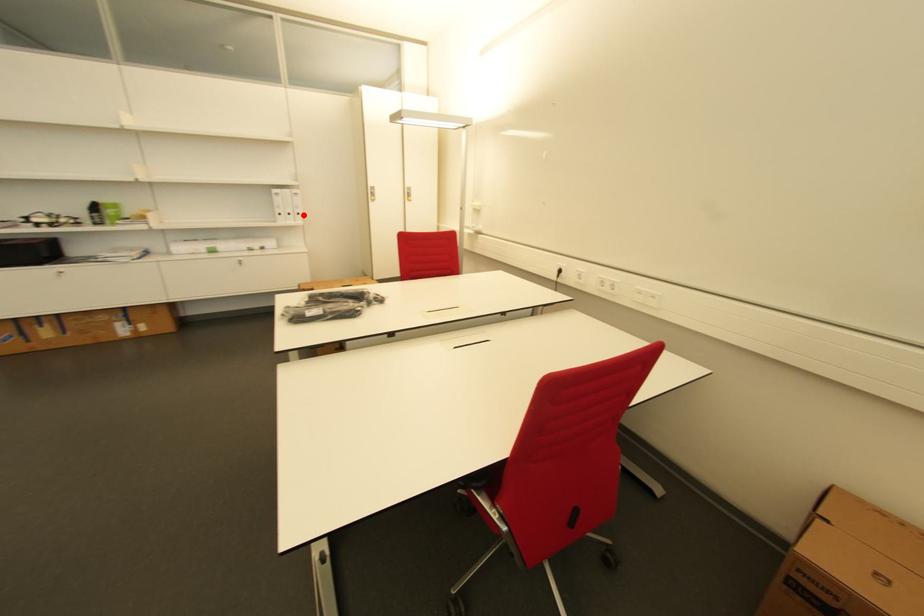
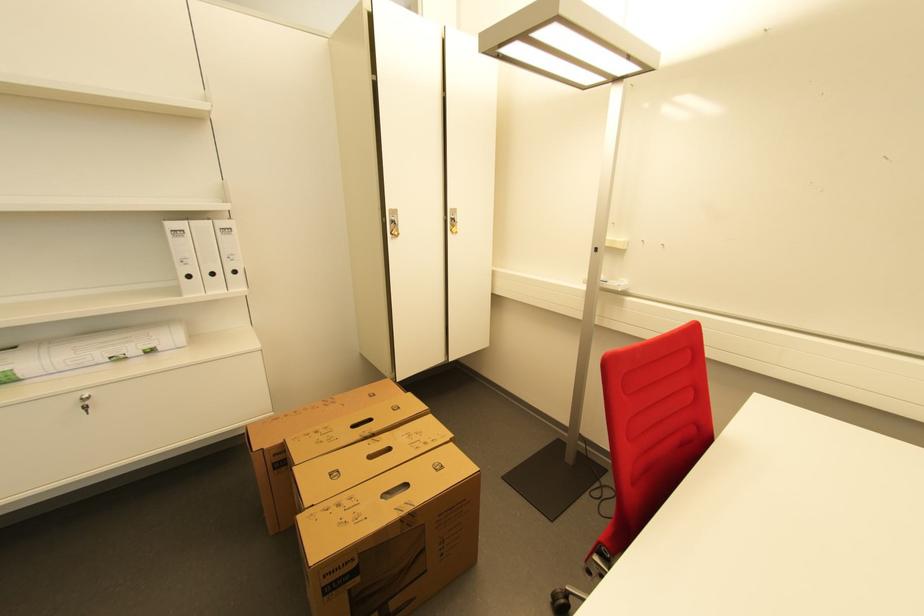
The point at the highlighted location is marked in the first image. Where is the corresponding point in the second image?

(239, 273)